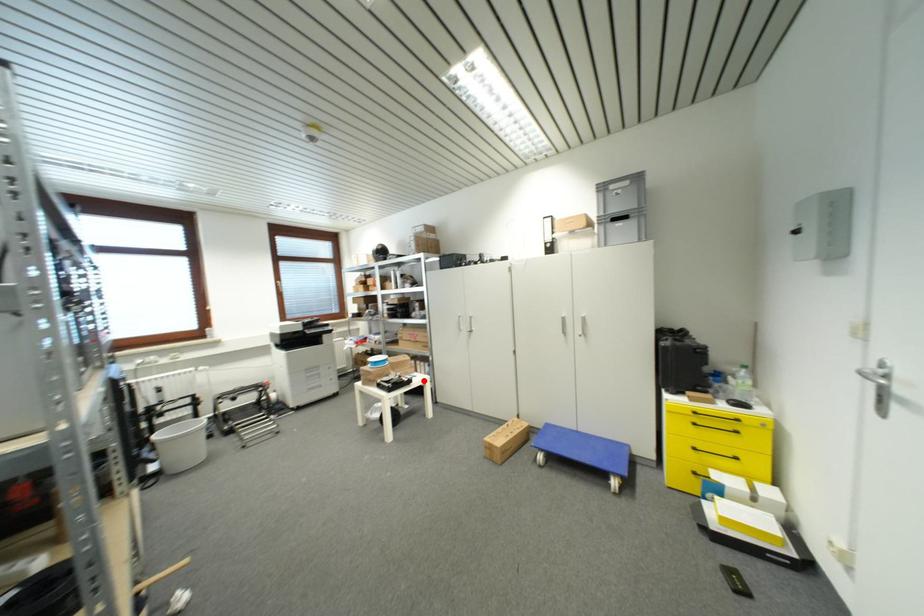
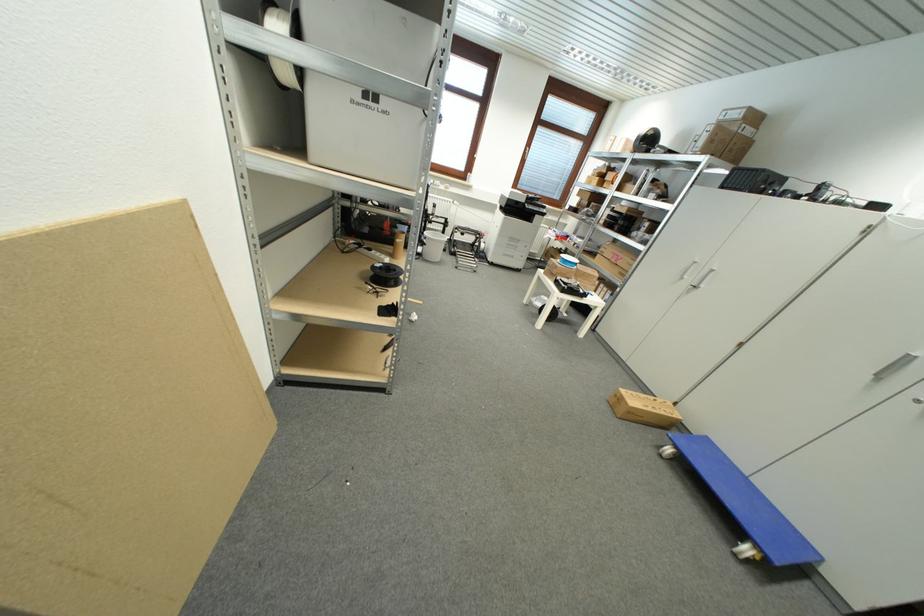
Question: I am providing you with two images of the same scene from different viewpoints. Image1 has a red point marked. In image2, the corresponding 3D location appears at what relative position? Reply with the corresponding letter.

Choices:
 (A) Closer
 (B) Farther

Answer: (A)